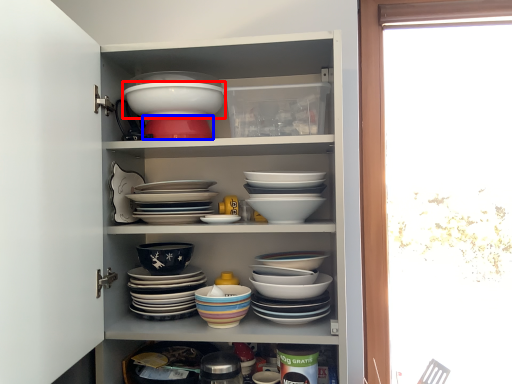
Question: Among these objects, which one is nearest to the camera, bowl (highlighted by a red box) or bowl (highlighted by a blue box)?

Choices:
 (A) bowl
 (B) bowl

Answer: (A)